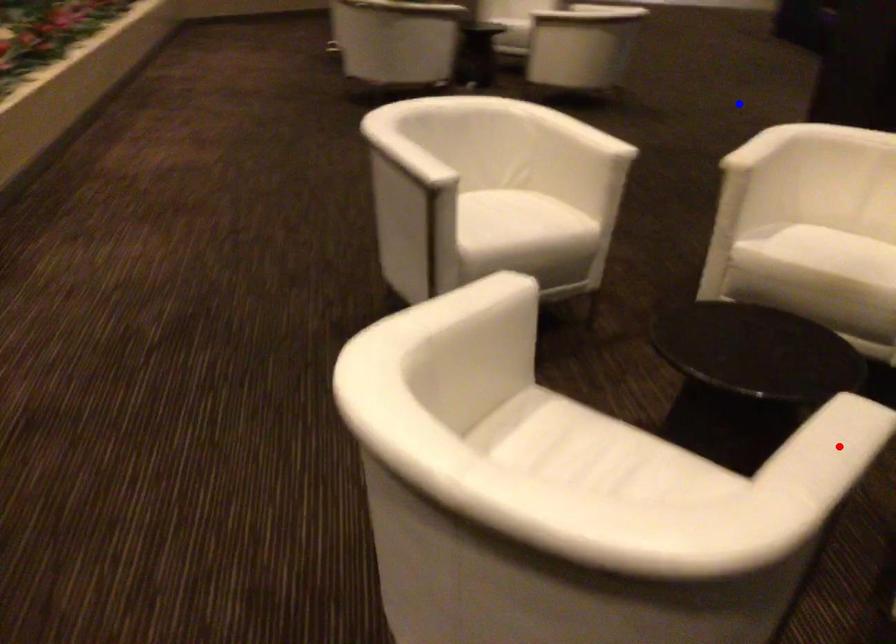
Question: Which of the two points in the image is closer to the camera?

Choices:
 (A) Blue point is closer.
 (B) Red point is closer.

Answer: (B)